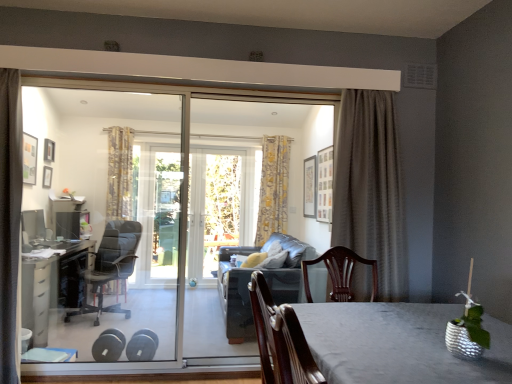
Question: From the image's perspective, is yellow floral fabric curtain at center, which is counted as the 2th curtain, starting from the left, positioned above or below dark grey textured curtain at right, which appears as the third curtain when viewed from the back?

Choices:
 (A) below
 (B) above

Answer: (B)

Question: Considering the relative positions of yellow floral fabric curtain at center, positioned as the 3th curtain in front-to-back order, and dark grey textured curtain at right, the 3th curtain when ordered from left to right, in the image provided, is yellow floral fabric curtain at center, positioned as the 3th curtain in front-to-back order, to the left or to the right of dark grey textured curtain at right, the 3th curtain when ordered from left to right,?

Choices:
 (A) left
 (B) right

Answer: (A)

Question: Which is farther from the yellow floral fabric curtain at center, acting as the 1th curtain starting from the back?

Choices:
 (A) yellow floral fabric curtain at left, marked as the second curtain in a front-to-back arrangement
 (B) black leather office chair at left
 (C) silvery metallic table at center, which is counted as the second table, starting from the left
 (D) dark grey textured curtain at right, acting as the first curtain starting from the right
 (E) dark gray leather couch at center

Answer: (C)

Question: Considering the real-world distances, which object is closest to the dark grey textured curtain at right, the 3th curtain when ordered from left to right?

Choices:
 (A) silvery metallic table at center, which ranks as the first table in front-to-back order
 (B) black leather office chair at left
 (C) yellow floral fabric curtain at center, acting as the 1th curtain starting from the back
 (D) black plastic desk at left, the 1th table viewed from the left
 (E) dark gray leather couch at center

Answer: (E)